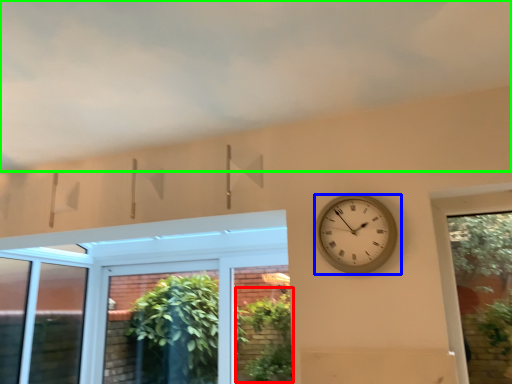
Question: Estimate the real-world distances between objects in this image. Which object is farther from plant (highlighted by a red box), wall clock (highlighted by a blue box) or cloud (highlighted by a green box)?

Choices:
 (A) wall clock
 (B) cloud

Answer: (B)